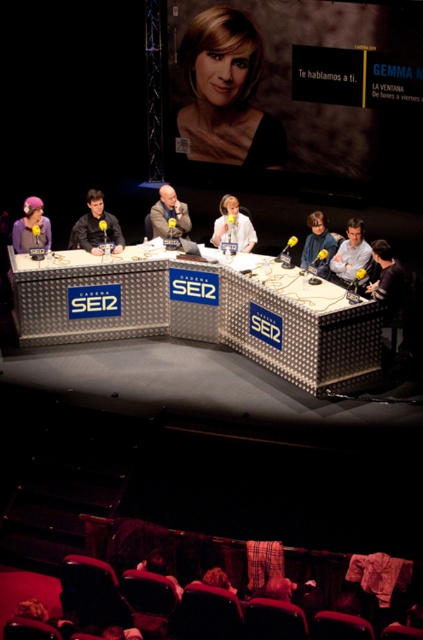
Is smooth gray jacket at center closer to the viewer compared to white matte jacket at center?

No, smooth gray jacket at center is further to the viewer.

Is point (161, 193) behind point (250, 230)?

That is False.

Image resolution: width=423 pixels, height=640 pixels. Identify the location of smooth gray jacket at center. [170, 214].

From the picture: Which of these two, matte purple wig at left or smooth gray jacket at center, stands shorter?

With less height is matte purple wig at left.

Is matte purple wig at left positioned behind smooth gray jacket at center?

That is False.

The height and width of the screenshot is (640, 423). Find the location of `matte purple wig at left`. matte purple wig at left is located at coordinates (30, 227).

Locate an element on the screen. matte purple wig at left is located at coordinates (30, 227).

Who is lower down, matte gray shirt at center or matte purple wig at left?

Positioned lower is matte gray shirt at center.

Which is in front, point (343, 253) or point (40, 205)?

Point (40, 205) is more forward.

What do you see at coordinates (351, 252) in the screenshot?
I see `matte gray shirt at center` at bounding box center [351, 252].

The width and height of the screenshot is (423, 640). I want to click on matte gray shirt at center, so click(x=351, y=252).